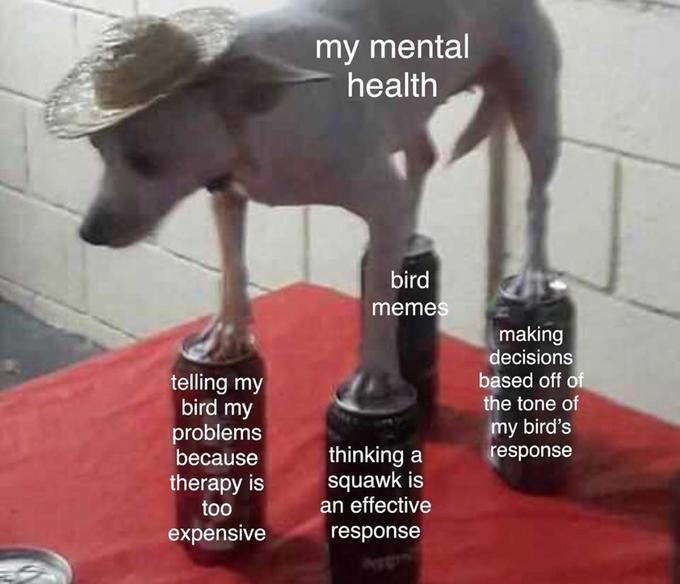
You are a GUI agent. You are given a task and a screenshot of the screen. Output one action in this format:
    pyautogui.click(x=<x>, y=<y>)
    Task: Click on the red tablecloth
    
    Given the screenshot: What is the action you would take?
    pyautogui.click(x=33, y=449)